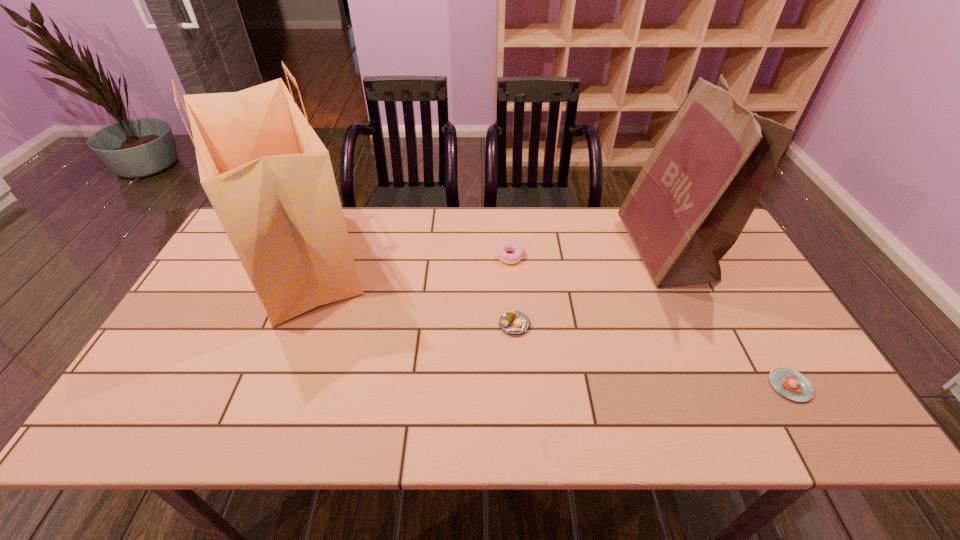
What are the coordinates of `object at the near right corner` in the screenshot? It's located at (790, 383).

In the image, there is a desktop. Find the location of `vacant space at the far edge`. vacant space at the far edge is located at coordinates (592, 222).

Locate an element on the screen. This screenshot has width=960, height=540. vacant space at the near edge of the desktop is located at coordinates (438, 426).

Identify the location of vacant space at the left edge. (199, 348).

Where is `vacant space at the right edge`? The width and height of the screenshot is (960, 540). vacant space at the right edge is located at coordinates (724, 263).

Find the location of a particular element. The width and height of the screenshot is (960, 540). blank area at the near left corner is located at coordinates (147, 428).

This screenshot has width=960, height=540. What are the coordinates of `vacant region between the rightmost pastry and the farthest pastry` in the screenshot? It's located at (650, 321).

This screenshot has width=960, height=540. I want to click on vacant area that lies between the right grocery bag and the farthest pastry, so click(x=588, y=253).

This screenshot has width=960, height=540. Identify the location of unoccupied area between the right grocery bag and the left grocery bag. (482, 255).

Image resolution: width=960 pixels, height=540 pixels. I want to click on vacant area that lies between the left grocery bag and the farthest pastry, so click(x=405, y=258).